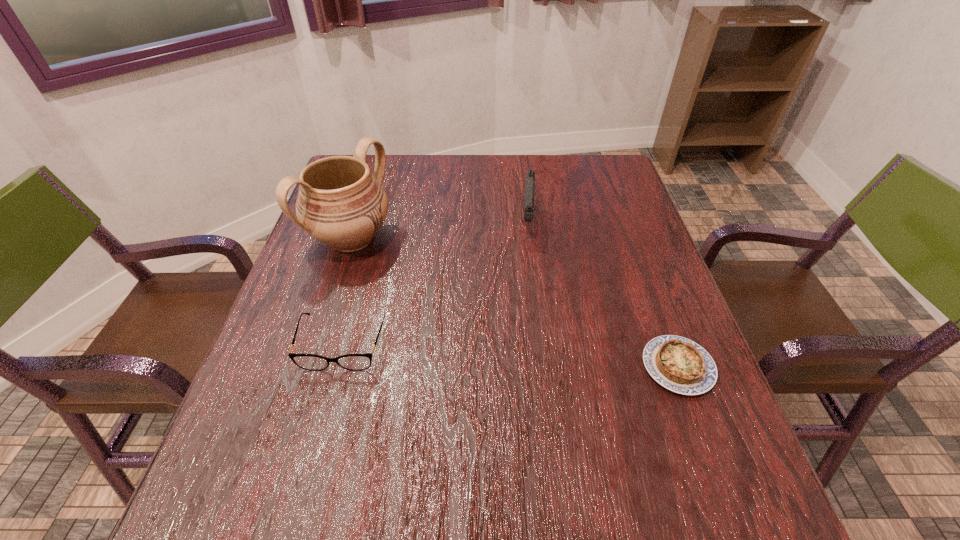
Locate an element on the screen. The image size is (960, 540). vacant space situated on the front-facing side of the tallest object is located at coordinates (446, 298).

Identify the location of free space located 0.140m at the barrel of the second tallest object. coord(527,281).

Locate an element on the screen. The height and width of the screenshot is (540, 960). free point located 0.190m at the barrel of the second tallest object is located at coordinates (527, 296).

Find the location of `blank space located 0.180m at the barrel of the second tallest object`. blank space located 0.180m at the barrel of the second tallest object is located at coordinates (527, 293).

The image size is (960, 540). What are the coordinates of `spectacles that is positioned at the left edge` in the screenshot? It's located at (355, 362).

The image size is (960, 540). I want to click on urn situated at the left edge, so click(x=340, y=203).

The height and width of the screenshot is (540, 960). In order to click on object that is at the right edge in this screenshot , I will do `click(679, 364)`.

In the image, there is a desktop. Where is `vacant space at the far edge`? The height and width of the screenshot is (540, 960). vacant space at the far edge is located at coordinates (539, 165).

I want to click on vacant space at the near edge of the desktop, so click(589, 451).

Locate an element on the screen. vacant region at the left edge is located at coordinates (288, 316).